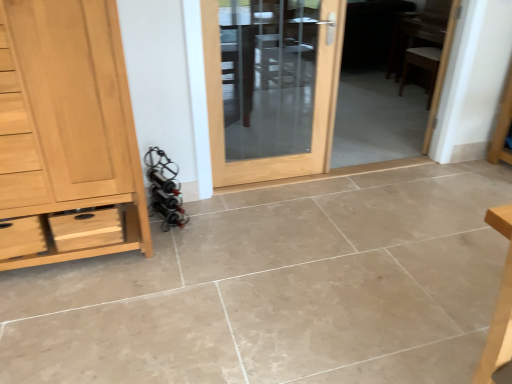
Question: From their relative heights in the image, would you say light brown wood chest of drawers at left is taller or shorter than matte wooden door at center?

Choices:
 (A) short
 (B) tall

Answer: (B)

Question: Considering the positions of light brown wood chest of drawers at left and matte wooden door at center in the image, is light brown wood chest of drawers at left bigger or smaller than matte wooden door at center?

Choices:
 (A) big
 (B) small

Answer: (A)

Question: Considering the real-world distances, which object is closest to the wooden chair at right, which is the first chair in top-to-bottom order?

Choices:
 (A) brown wooden chair at right, placed as the first chair when sorted from bottom to top
 (B) light brown wood chest of drawers at left
 (C) matte wooden door at center

Answer: (A)

Question: Which object is positioned closest to the brown wooden chair at right, placed as the first chair when sorted from bottom to top?

Choices:
 (A) matte wooden door at center
 (B) wooden chair at right, which is the first chair in top-to-bottom order
 (C) light brown wood chest of drawers at left

Answer: (B)